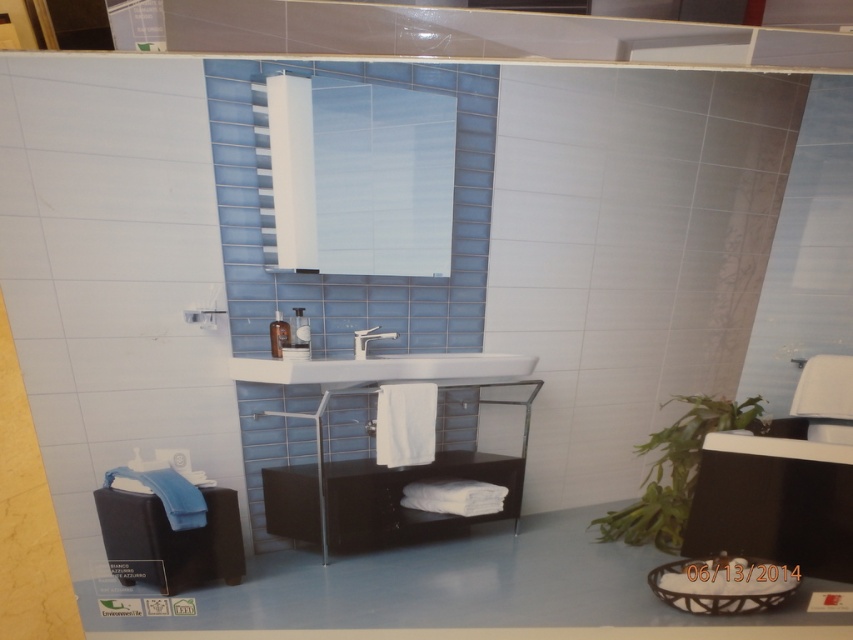
Question: Which point is closer to the camera?

Choices:
 (A) matte black stool at lower left
 (B) white glossy sink at center
 (C) black glossy vanity at center

Answer: (A)

Question: Does matte black stool at lower left have a larger size compared to white glossy sink at center?

Choices:
 (A) yes
 (B) no

Answer: (A)

Question: Does matte black stool at lower left appear under matte silver faucet at center?

Choices:
 (A) yes
 (B) no

Answer: (A)

Question: Is matte black stool at lower left to the left of matte silver faucet at center from the viewer's perspective?

Choices:
 (A) yes
 (B) no

Answer: (A)

Question: Which point appears farthest from the camera in this image?

Choices:
 (A) (314, 518)
 (B) (482, 378)

Answer: (B)

Question: Among these objects, which one is nearest to the camera?

Choices:
 (A) white glossy sink at center
 (B) matte black stool at lower left

Answer: (B)